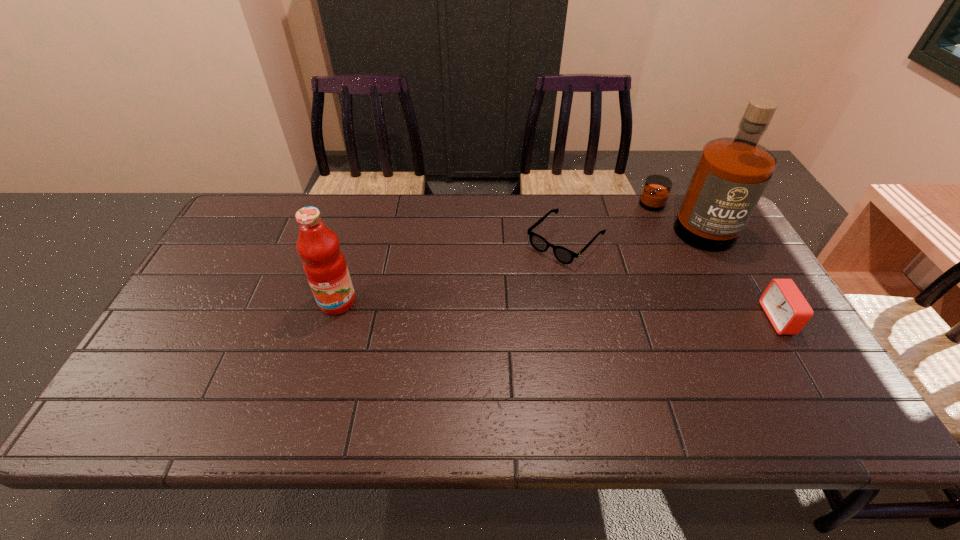
Locate an element on the screen. This screenshot has width=960, height=540. the leftmost object is located at coordinates (324, 264).

Image resolution: width=960 pixels, height=540 pixels. Identify the location of the third shortest object. (324, 264).

Where is `alarm clock`? alarm clock is located at coordinates (788, 311).

Where is `spectacles`? The width and height of the screenshot is (960, 540). spectacles is located at coordinates (562, 254).

The height and width of the screenshot is (540, 960). Find the location of `the second object from left to right`. the second object from left to right is located at coordinates (562, 254).

The image size is (960, 540). Find the location of `the tallest object`. the tallest object is located at coordinates (732, 173).

The height and width of the screenshot is (540, 960). Identify the location of vacant space located 0.140m on the front label of the leftmost object. (320, 362).

Where is `blank space located on the front-facing side of the third tallest object`? This screenshot has width=960, height=540. blank space located on the front-facing side of the third tallest object is located at coordinates (708, 319).

The width and height of the screenshot is (960, 540). In order to click on free point located on the front-facing side of the third tallest object in this screenshot , I will do `click(643, 319)`.

Image resolution: width=960 pixels, height=540 pixels. What are the coordinates of `free space located on the front-facing side of the third tallest object` in the screenshot? It's located at (712, 319).